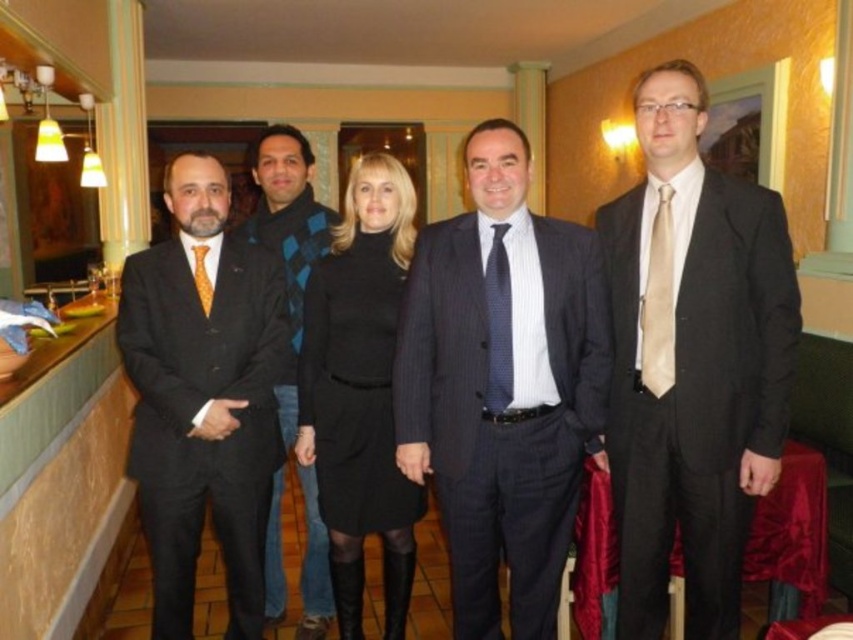
Who is more forward, (669,211) or (305,637)?

Point (669,211) is in front.

Can you confirm if matte black suit at right is positioned to the right of matte black jacket at center?

Yes, matte black suit at right is to the right of matte black jacket at center.

Does point (709, 381) come behind point (300, 150)?

No, it is not.

Where is `matte black suit at right`? Image resolution: width=853 pixels, height=640 pixels. matte black suit at right is located at coordinates (692, 362).

Which is more to the left, matte black suit at right or orange silk tie at left?

Positioned to the left is orange silk tie at left.

Does matte black suit at right lie behind orange silk tie at left?

No, it is in front of orange silk tie at left.

Does point (762, 253) come in front of point (199, 244)?

Yes.

Where is `matte black suit at right`? The width and height of the screenshot is (853, 640). matte black suit at right is located at coordinates (692, 362).

Does dark gray pinstripe suit at center have a lesser width compared to dark blue textured tie at center?

In fact, dark gray pinstripe suit at center might be wider than dark blue textured tie at center.

Measure the distance between point (572, 528) and camera.

Point (572, 528) and camera are 7.33 feet apart from each other.

Locate an element on the screen. dark gray pinstripe suit at center is located at coordinates (502, 385).

At what (x,y) coordinates should I click in order to perform the action: click on dark gray pinstripe suit at center. Please return your answer as a coordinate pair (x, y). The height and width of the screenshot is (640, 853). Looking at the image, I should click on (502, 385).